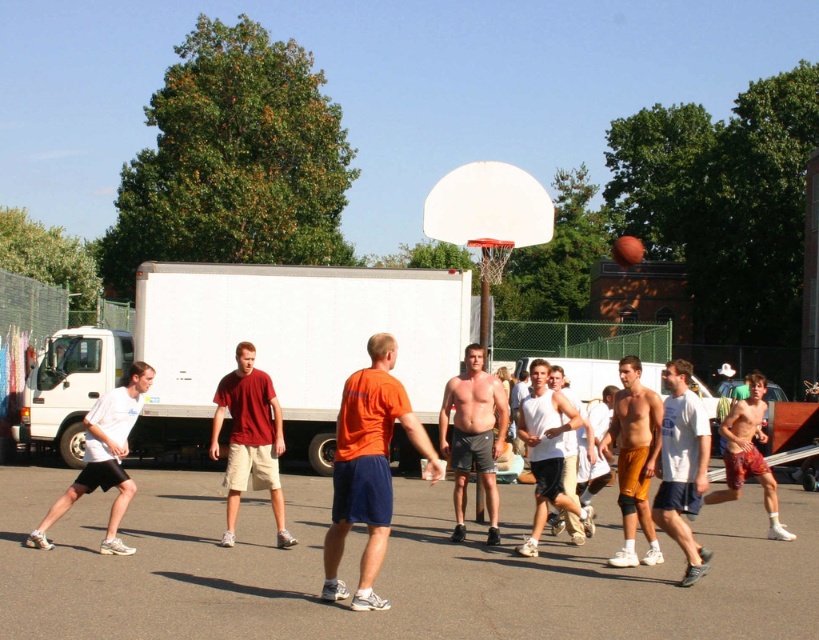
You are a photographer trying to capture a photo of the basketball game. You notice the orange fabric shirt at center and the white matte shorts at left. Which object should you zoom in on to focus on the smaller one?

The orange fabric shirt at center is smaller than the white matte shorts at left, so you should zoom in on the orange fabric shirt at center to focus on the smaller one.

You are standing at the center of the basketball court and want to throw a ball to a friend who is at point (716,493). There is an obstacle at point (329,582). Will the obstacle block your direct path to your friend?

Point (329,582) is closer to the camera than point (716,493), so the obstacle at point (329,582) will block your direct path to your friend at point (716,493).